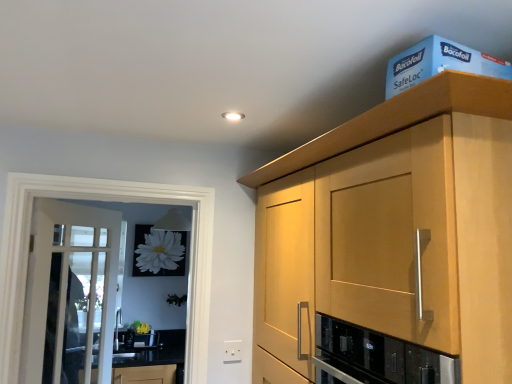
Describe the element at coordinates (439, 64) in the screenshot. The height and width of the screenshot is (384, 512). I see `blue cardboard box at upper right` at that location.

You are a GUI agent. You are given a task and a screenshot of the screen. Output one action in this format:
    pyautogui.click(x=<x>, y=<y>)
    Task: Click on the white glass door at left
    
    Given the screenshot: What is the action you would take?
    pyautogui.click(x=71, y=293)

Measure the distance between point (236, 343) and camera.

Point (236, 343) and camera are 2.01 meters apart.

The height and width of the screenshot is (384, 512). I want to click on black glass oven at center, so click(376, 357).

I want to click on cabinetry below the blue cardboard box at upper right (from the image's perspective), so click(397, 119).

Is light wood cabinet at upper right oriented away from blue cardboard box at upper right?

No, blue cardboard box at upper right is not at the back of light wood cabinet at upper right.

Which object is closer to the camera, light wood cabinet at upper right or blue cardboard box at upper right?

Positioned in front is light wood cabinet at upper right.

Between light wood cabinet at upper right and blue cardboard box at upper right, which one has larger size?

Bigger between the two is light wood cabinet at upper right.

Can we say blue cardboard box at upper right lies outside light wood cabinet at upper right?

Absolutely, blue cardboard box at upper right is external to light wood cabinet at upper right.

Where is `box behind the light wood cabinet at upper right`? The image size is (512, 384). box behind the light wood cabinet at upper right is located at coordinates (439, 64).

Is blue cardboard box at upper right at the right side of light wood cabinet at upper right?

Yes.

Does blue cardboard box at upper right have a larger size compared to light wood cabinet at upper right?

No, blue cardboard box at upper right is not bigger than light wood cabinet at upper right.

How far apart are light wood cabinet at upper right and white plastic electric outlet at lower center?

light wood cabinet at upper right and white plastic electric outlet at lower center are 3.61 feet apart from each other.

From the image's perspective, is light wood cabinet at upper right above white plastic electric outlet at lower center?

Yes, from the image's perspective, light wood cabinet at upper right is over white plastic electric outlet at lower center.

Can you confirm if light wood cabinet at upper right is positioned to the right of white plastic electric outlet at lower center?

Yes, light wood cabinet at upper right is to the right of white plastic electric outlet at lower center.

Is light wood cabinet at upper right placed right next to white plastic electric outlet at lower center?

No, light wood cabinet at upper right is not touching white plastic electric outlet at lower center.

From the image's perspective, is white glass door at left beneath clear glass screen door at left?

Yes.

Which object is further away from the camera, white glass door at left or clear glass screen door at left?

white glass door at left is behind.

Where is `door below the clear glass screen door at left (from a real-world perspective)`? door below the clear glass screen door at left (from a real-world perspective) is located at coordinates (71, 293).

In the image, is white glass door at left on the left side or the right side of clear glass screen door at left?

white glass door at left is to the left of clear glass screen door at left.

Does point (19, 181) appear closer or farther from the camera than point (461, 52)?

Clearly, point (19, 181) is more distant from the camera than point (461, 52).

Looking at this image, from the image's perspective, would you say clear glass screen door at left is positioned over blue cardboard box at upper right?

No, from the image's perspective, clear glass screen door at left is not on top of blue cardboard box at upper right.

In the scene shown: Considering the sizes of objects clear glass screen door at left and blue cardboard box at upper right in the image provided, who is bigger, clear glass screen door at left or blue cardboard box at upper right?

clear glass screen door at left is bigger.

Is clear glass screen door at left facing towards blue cardboard box at upper right?

Yes, clear glass screen door at left is aimed at blue cardboard box at upper right.

Is the position of white glass door at left more distant than that of light wood cabinet at upper right?

Yes, white glass door at left is behind light wood cabinet at upper right.

Choose the correct answer: Is white glass door at left inside light wood cabinet at upper right or outside it?

white glass door at left is located beyond the bounds of light wood cabinet at upper right.

Is white glass door at left facing towards light wood cabinet at upper right?

Yes, white glass door at left is oriented towards light wood cabinet at upper right.

Considering the positions of points (103, 256) and (352, 144), is point (103, 256) closer to camera compared to point (352, 144)?

That is False.

Is light wood cabinet at upper right in contact with clear glass screen door at left?

light wood cabinet at upper right and clear glass screen door at left are not in contact.

Is light wood cabinet at upper right positioned with its back to clear glass screen door at left?

No, light wood cabinet at upper right's orientation is not away from clear glass screen door at left.

Is light wood cabinet at upper right to the left of clear glass screen door at left from the viewer's perspective?

Incorrect, light wood cabinet at upper right is not on the left side of clear glass screen door at left.

In order to click on cabinetry below the blue cardboard box at upper right (from a real-world perspective) in this screenshot , I will do `click(397, 119)`.

Find the location of `cabinetry that is on the left side of blue cardboard box at upper right`. cabinetry that is on the left side of blue cardboard box at upper right is located at coordinates (397, 119).

From the image, which object appears to be farther from black granite countertop at lower left, clear glass screen door at left or blue cardboard box at upper right?

blue cardboard box at upper right.

Considering their positions, is black granite countertop at lower left positioned closer to blue cardboard box at upper right than light wood cabinet at upper right?

light wood cabinet at upper right is positioned closer to the anchor blue cardboard box at upper right.

Based on the photo, which object lies further to the anchor point light wood cabinet at upper right, white plastic electric outlet at lower center or black granite countertop at lower left?

The object further to light wood cabinet at upper right is black granite countertop at lower left.

From the image, which object appears to be nearer to black granite countertop at lower left, white plastic electric outlet at lower center or blue cardboard box at upper right?

The object closer to black granite countertop at lower left is white plastic electric outlet at lower center.

Looking at the image, which one is located further to white plastic electric outlet at lower center, black glass oven at center or white glass door at left?

Based on the image, black glass oven at center appears to be further to white plastic electric outlet at lower center.

From the image, which object appears to be farther from light wood cabinet at upper right, black glass oven at center or white plastic electric outlet at lower center?

white plastic electric outlet at lower center lies further to light wood cabinet at upper right than the other object.

Estimate the real-world distances between objects in this image. Which object is closer to clear glass screen door at left, white glass door at left or blue cardboard box at upper right?

Based on the image, white glass door at left appears to be nearer to clear glass screen door at left.

When comparing their distances from white plastic electric outlet at lower center, does white glass door at left or light wood cabinet at upper right seem closer?

white glass door at left is closer to white plastic electric outlet at lower center.

The image size is (512, 384). What are the coordinates of `screen door located between white glass door at left and blue cardboard box at upper right in the left-right direction` in the screenshot? It's located at (101, 200).

I want to click on screen door positioned between black glass oven at center and white plastic electric outlet at lower center from near to far, so click(101, 200).

Find the location of `cabinetry between white glass door at left and blue cardboard box at upper right from left to right`. cabinetry between white glass door at left and blue cardboard box at upper right from left to right is located at coordinates (397, 119).

Locate an element on the screen. This screenshot has width=512, height=384. electric outlet positioned between light wood cabinet at upper right and black granite countertop at lower left from near to far is located at coordinates (232, 351).